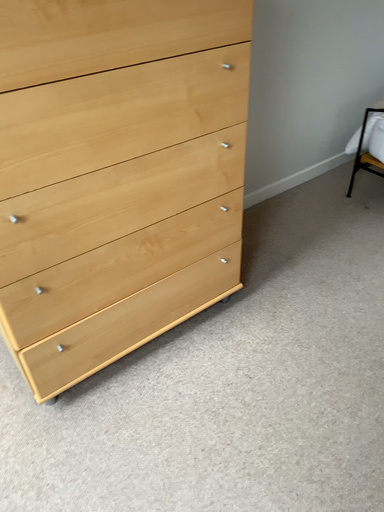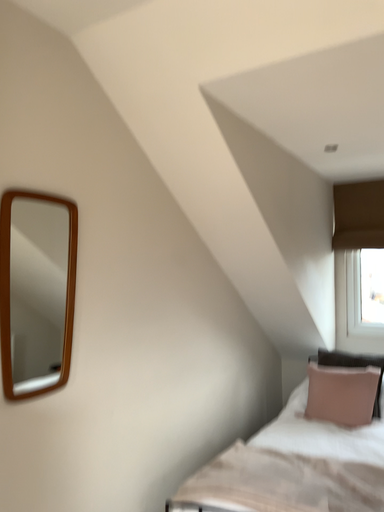
Question: Which way did the camera rotate in the video?

Choices:
 (A) rotated downward
 (B) rotated upward

Answer: (B)